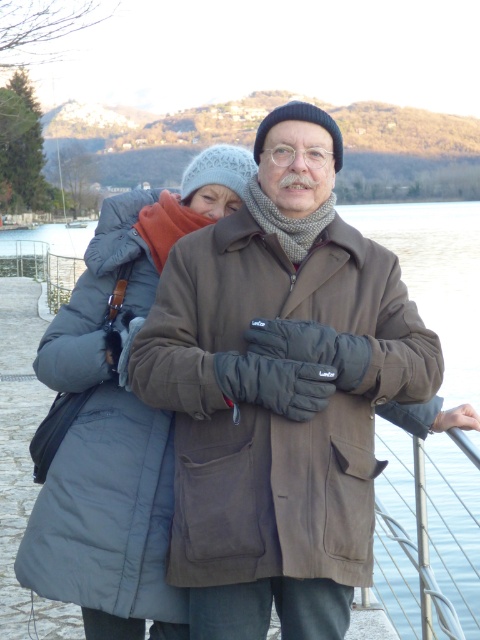
Question: Which object appears closest to the camera in this image?

Choices:
 (A) brown suede coat at center
 (B) gray puffy coat at center

Answer: (A)

Question: Does brown suede coat at center appear on the right side of gray puffy coat at center?

Choices:
 (A) no
 (B) yes

Answer: (B)

Question: Among these points, which one is farthest from the camera?

Choices:
 (A) (292, 196)
 (B) (135, 589)

Answer: (B)

Question: Does brown suede coat at center appear on the right side of gray puffy coat at center?

Choices:
 (A) yes
 (B) no

Answer: (A)

Question: Does brown suede coat at center appear under gray puffy coat at center?

Choices:
 (A) no
 (B) yes

Answer: (B)